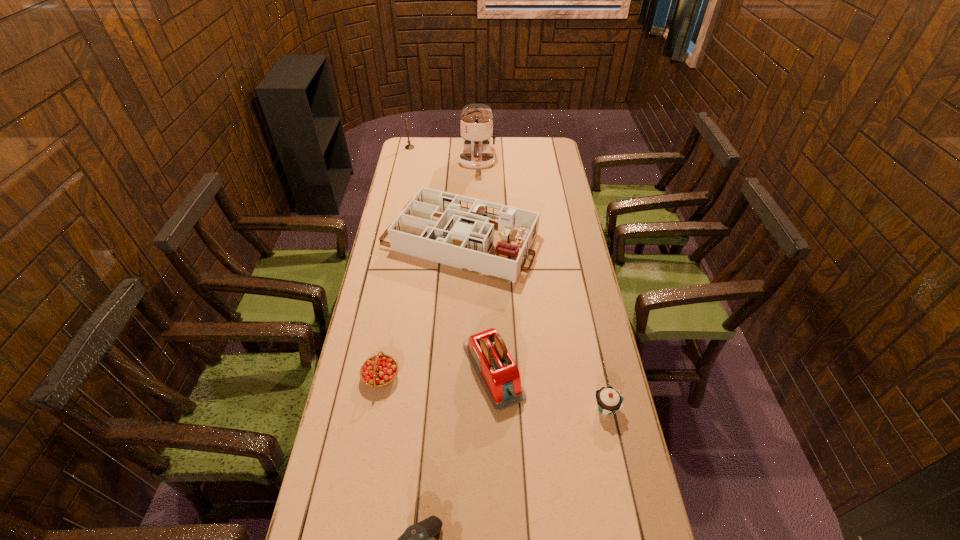
Where is `coffee maker`? The image size is (960, 540). coffee maker is located at coordinates 476,121.

The height and width of the screenshot is (540, 960). Find the location of `candle`. candle is located at coordinates (409, 146).

Find the location of `toaster`. toaster is located at coordinates (499, 375).

I want to click on the fifth nearest object, so click(455, 230).

Locate an element on the screen. The width and height of the screenshot is (960, 540). dollhouse is located at coordinates (455, 230).

Image resolution: width=960 pixels, height=540 pixels. I want to click on strawberry, so click(378, 371).

This screenshot has width=960, height=540. Identify the location of cupcake. (608, 400).

Where is `vacant area situated 0.210m on the front-facing side of the coffee maker`? This screenshot has height=540, width=960. vacant area situated 0.210m on the front-facing side of the coffee maker is located at coordinates (477, 207).

I want to click on free spot located on the front of the candle, so [404, 174].

Find the location of `vacant space located on the front of the toaster`. vacant space located on the front of the toaster is located at coordinates (496, 517).